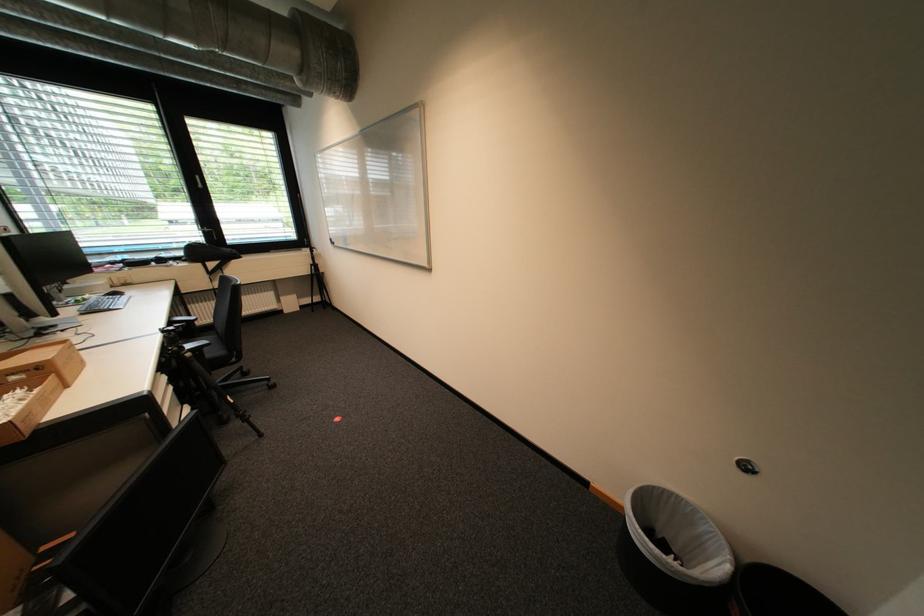
Identify the location of black chair sitting surface. (201, 365).